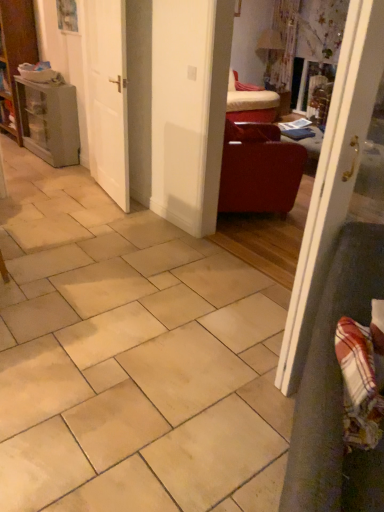
Describe the element at coordinates (334, 177) in the screenshot. I see `white glossy door at right, placed as the 1th door when sorted from right to left` at that location.

This screenshot has height=512, width=384. What do you see at coordinates (106, 95) in the screenshot? I see `white matte door at center, arranged as the 2th door when viewed from the front` at bounding box center [106, 95].

Find the location of `plaid fabric armchair at lower right`. plaid fabric armchair at lower right is located at coordinates (335, 390).

Is beige ceramic tile at center wider or thinner than matte leather armchair at center-right?

Considering their sizes, beige ceramic tile at center looks broader than matte leather armchair at center-right.

From a real-world perspective, is beige ceramic tile at center under matte leather armchair at center-right?

Yes, from a real-world perspective, beige ceramic tile at center is below matte leather armchair at center-right.

Which of these two, beige ceramic tile at center or matte leather armchair at center-right, stands shorter?

beige ceramic tile at center.

Does beige ceramic tile at center turn towards matte leather armchair at center-right?

No, beige ceramic tile at center does not turn towards matte leather armchair at center-right.

Which object is closer to the camera, white glossy door at right, acting as the second door starting from the left, or matte leather armchair at center-right?

white glossy door at right, acting as the second door starting from the left, is in front.

Between point (337, 208) and point (236, 142), which one is positioned behind?

Point (236, 142)

Would you consider white glossy door at right, placed as the 1th door when sorted from right to left, to be distant from matte leather armchair at center-right?

Absolutely, white glossy door at right, placed as the 1th door when sorted from right to left, is distant from matte leather armchair at center-right.

Could you measure the distance between white glossy door at right, acting as the second door starting from the left, and matte leather armchair at center-right?

white glossy door at right, acting as the second door starting from the left, is 1.81 meters from matte leather armchair at center-right.

Is beige ceramic tile at center not close to plaid fabric armchair at lower right?

They are positioned close to each other.

Is beige ceramic tile at center wider or thinner than plaid fabric armchair at lower right?

In the image, beige ceramic tile at center appears to be wider than plaid fabric armchair at lower right.

Is beige ceramic tile at center turned away from plaid fabric armchair at lower right?

No.

Considering the sizes of objects beige ceramic tile at center and plaid fabric armchair at lower right in the image provided, who is taller, beige ceramic tile at center or plaid fabric armchair at lower right?

Standing taller between the two is plaid fabric armchair at lower right.

Between plaid fabric armchair at lower right and white glossy door at right, which ranks as the second door in back-to-front order, which one has smaller width?

white glossy door at right, which ranks as the second door in back-to-front order, is thinner.

Does plaid fabric armchair at lower right appear on the right side of white glossy door at right, acting as the second door starting from the left?

No.

From the image's perspective, is plaid fabric armchair at lower right located above or below white glossy door at right, which ranks as the second door in back-to-front order?

From the image's perspective, plaid fabric armchair at lower right appears below white glossy door at right, which ranks as the second door in back-to-front order.

Is matte leather armchair at center-right turned away from white matte door at center, which ranks as the 1th door in back-to-front order?

Yes, matte leather armchair at center-right is positioned with its back facing white matte door at center, which ranks as the 1th door in back-to-front order.

Is white matte door at center, the second door positioned from the right, surrounded by matte leather armchair at center-right?

No, white matte door at center, the second door positioned from the right, is not a part of matte leather armchair at center-right.

From a real-world perspective, is matte leather armchair at center-right positioned above or below white matte door at center, the 1th door when ordered from left to right?

Clearly, from a real-world perspective, matte leather armchair at center-right is below white matte door at center, the 1th door when ordered from left to right.

How different are the orientations of matte leather armchair at center-right and white matte door at center, arranged as the 2th door when viewed from the front, in degrees?

The angular difference between matte leather armchair at center-right and white matte door at center, arranged as the 2th door when viewed from the front, is 158 degrees.

Considering the relative sizes of beige ceramic tile at center and white matte door at center, the 1th door when ordered from left to right, in the image provided, is beige ceramic tile at center thinner than white matte door at center, the 1th door when ordered from left to right,?

No, beige ceramic tile at center is not thinner than white matte door at center, the 1th door when ordered from left to right.

From the image's perspective, which one is positioned lower, beige ceramic tile at center or white matte door at center, the second door positioned from the right?

beige ceramic tile at center appears lower in the image.

The height and width of the screenshot is (512, 384). Identify the location of ceramic tile lying in front of the white matte door at center, the 1th door when ordered from left to right. (135, 367).

Can you confirm if plaid fabric armchair at lower right is bigger than matte gray cabinet at left?

Yes.

Is plaid fabric armchair at lower right further to camera compared to matte gray cabinet at left?

No, plaid fabric armchair at lower right is closer to the camera.

Locate an element on the screen. This screenshot has width=384, height=512. armchair on the right of the matte gray cabinet at left is located at coordinates (335, 390).

At what (x,y) coordinates should I click in order to perform the action: click on ceramic tile to the left of matte leather armchair at center-right. Please return your answer as a coordinate pair (x, y). This screenshot has height=512, width=384. Looking at the image, I should click on (135, 367).

There is a matte leather armchair at center-right. Identify the location of the 2nd door above it (from a real-world perspective). (334, 177).

Considering their positions, is matte gray cabinet at left positioned closer to matte leather armchair at center-right than white glossy door at right, placed as the first door when sorted from front to back?

white glossy door at right, placed as the first door when sorted from front to back, lies closer to matte leather armchair at center-right than the other object.

When comparing their distances from plaid fabric armchair at lower right, does matte leather armchair at center-right or matte gray cabinet at left seem further?

matte gray cabinet at left.

Looking at the image, which one is located further to matte gray cabinet at left, matte leather armchair at center-right or white glossy door at right, placed as the first door when sorted from front to back?

white glossy door at right, placed as the first door when sorted from front to back, is further to matte gray cabinet at left.

Which object lies nearer to the anchor point plaid fabric armchair at lower right, beige ceramic tile at center or matte leather armchair at center-right?

Based on the image, beige ceramic tile at center appears to be nearer to plaid fabric armchair at lower right.

Based on their spatial positions, is matte gray cabinet at left or beige ceramic tile at center closer to white glossy door at right, placed as the 1th door when sorted from right to left?

Based on the image, beige ceramic tile at center appears to be nearer to white glossy door at right, placed as the 1th door when sorted from right to left.

Based on their spatial positions, is white glossy door at right, acting as the second door starting from the left, or plaid fabric armchair at lower right closer to matte leather armchair at center-right?

white glossy door at right, acting as the second door starting from the left, is positioned closer to the anchor matte leather armchair at center-right.

From the picture: Considering their positions, is white matte door at center, which ranks as the 1th door in back-to-front order, positioned closer to matte leather armchair at center-right than beige ceramic tile at center?

A: white matte door at center, which ranks as the 1th door in back-to-front order.

From the image, which object appears to be farther from plaid fabric armchair at lower right, white matte door at center, the 1th door when ordered from left to right, or matte leather armchair at center-right?

Based on the image, white matte door at center, the 1th door when ordered from left to right, appears to be further to plaid fabric armchair at lower right.

Locate an element on the screen. ceramic tile between plaid fabric armchair at lower right and white matte door at center, the 1th door when ordered from left to right, along the z-axis is located at coordinates (135, 367).

I want to click on door positioned between plaid fabric armchair at lower right and white matte door at center, arranged as the 2th door when viewed from the front, from near to far, so click(x=334, y=177).

Where is `door between matte gray cabinet at left and matte leather armchair at center-right in the horizontal direction`? door between matte gray cabinet at left and matte leather armchair at center-right in the horizontal direction is located at coordinates (106, 95).

The width and height of the screenshot is (384, 512). I want to click on ceramic tile positioned between plaid fabric armchair at lower right and matte gray cabinet at left from near to far, so (135, 367).